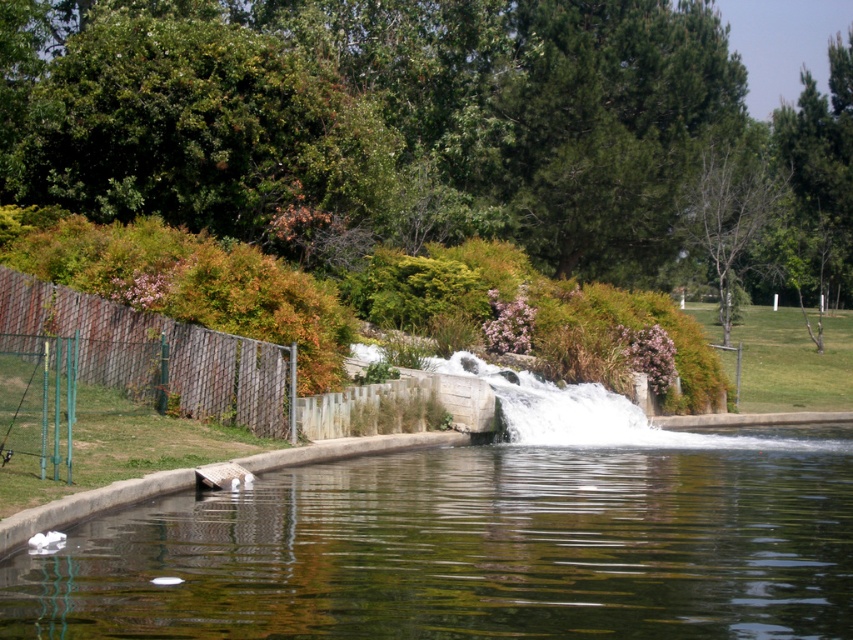
Who is more forward, [624,625] or [212,388]?

Positioned in front is point [624,625].

Is clear water at center above brown mesh fence at left?

Incorrect, clear water at center is not positioned above brown mesh fence at left.

Who is more distant from viewer, (579, 509) or (154, 372)?

The point (154, 372) is behind.

The width and height of the screenshot is (853, 640). Find the location of `clear water at center`. clear water at center is located at coordinates (474, 547).